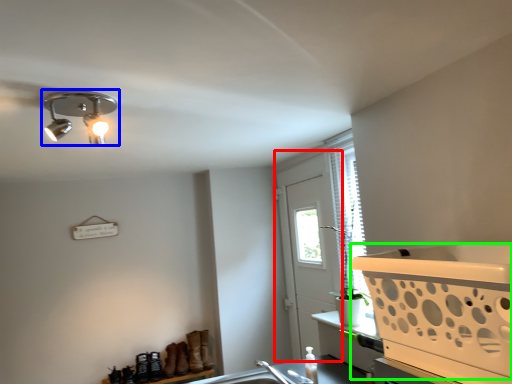
Question: Considering the real-world distances, which object is closest to screen door (highlighted by a red box)? lamp (highlighted by a blue box) or basket (highlighted by a green box).

Choices:
 (A) lamp
 (B) basket

Answer: (B)